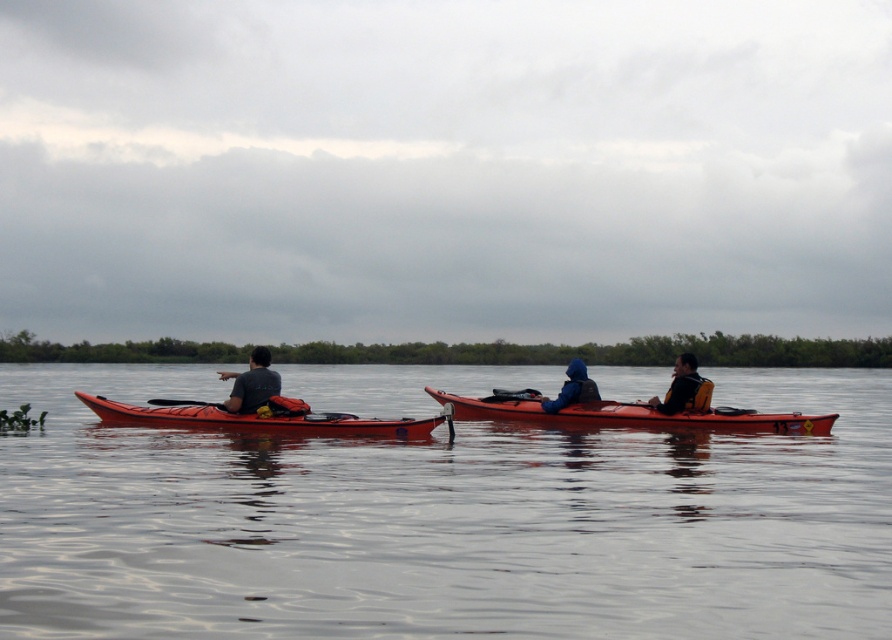
Question: Which point is closer to the camera?

Choices:
 (A) transparent water at center
 (B) blue matte jacket at center
 (C) black rubber paddle at left
 (D) matte orange canoe at center

Answer: (A)

Question: Based on their relative distances, which object is nearer to the black rubber paddle at left?

Choices:
 (A) yellow life vest at right
 (B) matte red kayak at left
 (C) matte black kayak at left
 (D) matte orange canoe at center

Answer: (B)

Question: Does matte orange canoe at center have a greater width compared to matte red kayak at left?

Choices:
 (A) no
 (B) yes

Answer: (B)

Question: Which is nearer to the matte red kayak at left?

Choices:
 (A) black rubber paddle at left
 (B) matte black kayak at left

Answer: (A)

Question: Is blue matte jacket at center smaller than black rubber paddle at left?

Choices:
 (A) yes
 (B) no

Answer: (B)

Question: Does blue matte jacket at center have a larger size compared to black rubber paddle at left?

Choices:
 (A) yes
 (B) no

Answer: (A)